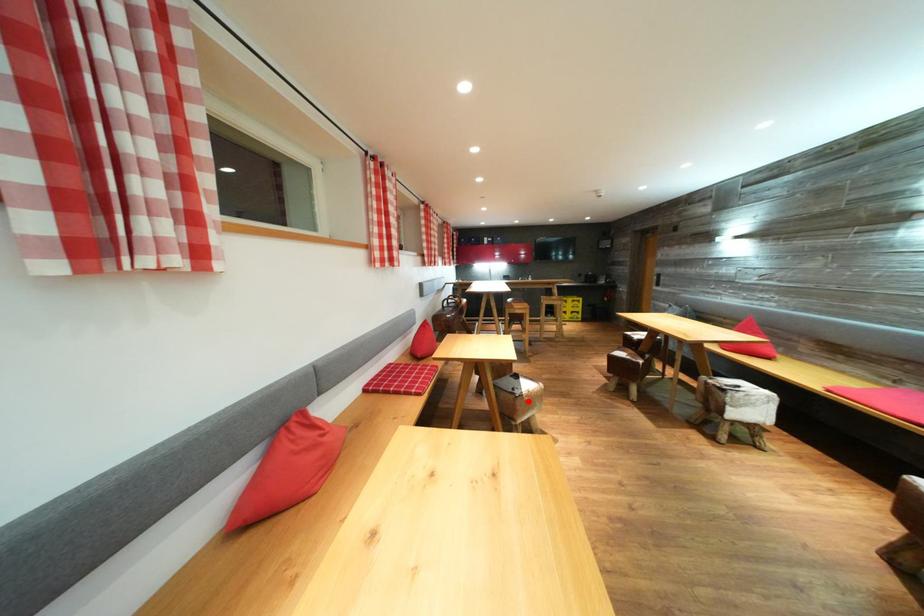
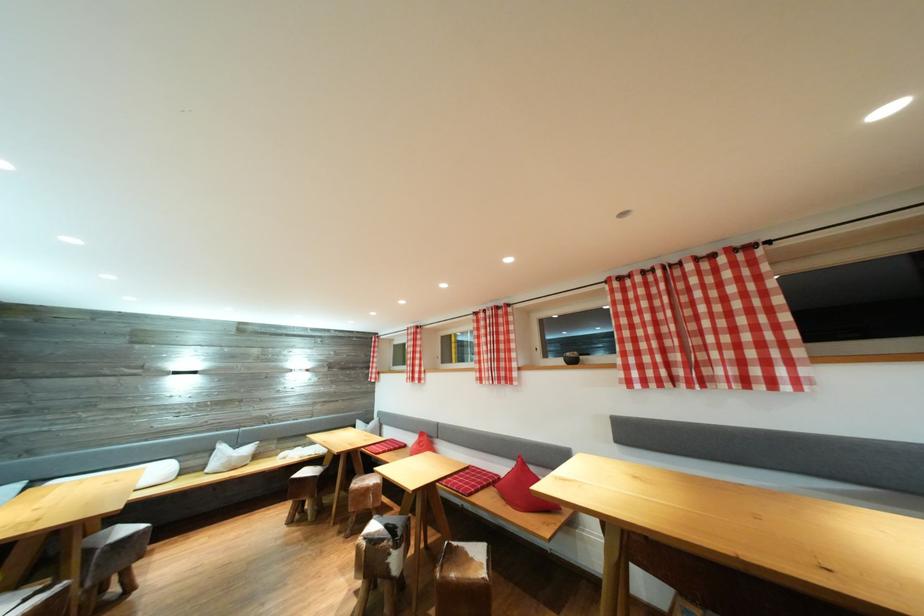
Question: I am providing you with two images of the same scene from different viewpoints. A red point is marked on the first image. At the location where the point appears in image 1, is it still visible in image 2?

Choices:
 (A) Yes
 (B) No

Answer: (B)